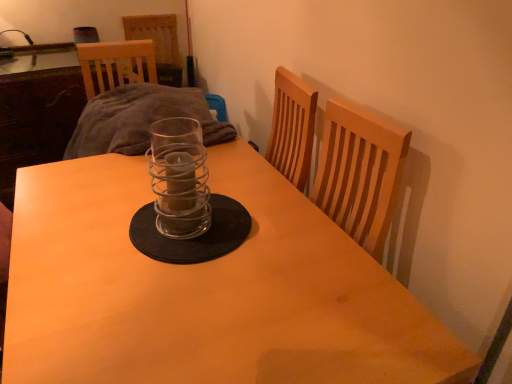
I want to click on wooden table at center, so click(x=205, y=290).

Looking at this image, in order to face wooden table at center, should I rotate leftwards or rightwards?

Rotate left and turn 8.654 degrees.

The image size is (512, 384). What do you see at coordinates (205, 290) in the screenshot?
I see `wooden table at center` at bounding box center [205, 290].

The width and height of the screenshot is (512, 384). Describe the element at coordinates (179, 178) in the screenshot. I see `clear glass candle holder at center` at that location.

The width and height of the screenshot is (512, 384). What are the coordinates of `clear glass candle holder at center` in the screenshot? It's located at (179, 178).

In order to click on wooden table at center in this screenshot , I will do `click(205, 290)`.

Can you confirm if wooden table at center is positioned to the right of clear glass candle holder at center?

In fact, wooden table at center is to the left of clear glass candle holder at center.

Is wooden table at center positioned behind clear glass candle holder at center?

No, wooden table at center is in front of clear glass candle holder at center.

Does point (197, 305) come farther from viewer compared to point (153, 130)?

No.

From the image's perspective, who appears lower, wooden table at center or clear glass candle holder at center?

wooden table at center appears lower in the image.

From a real-world perspective, which object stands above the other?

clear glass candle holder at center is physically above.

Which of these two, wooden table at center or clear glass candle holder at center, is thinner?

With smaller width is clear glass candle holder at center.

In terms of height, does wooden table at center look taller or shorter compared to clear glass candle holder at center?

wooden table at center is taller than clear glass candle holder at center.

From the picture: Can you confirm if wooden table at center is bigger than clear glass candle holder at center?

Indeed, wooden table at center has a larger size compared to clear glass candle holder at center.

Is wooden table at center inside the boundaries of clear glass candle holder at center, or outside?

wooden table at center is spatially situated outside clear glass candle holder at center.

Are wooden table at center and clear glass candle holder at center beside each other?

No, wooden table at center is not making contact with clear glass candle holder at center.

Is wooden table at center facing away from clear glass candle holder at center?

wooden table at center is not turned away from clear glass candle holder at center.

Can you tell me how much wooden table at center and clear glass candle holder at center differ in facing direction?

The facing directions of wooden table at center and clear glass candle holder at center are 0.887 degrees apart.

At what (x,y) coordinates should I click in order to perform the action: click on table in front of the clear glass candle holder at center. Please return your answer as a coordinate pair (x, y). Looking at the image, I should click on click(x=205, y=290).

Considering the positions of objects clear glass candle holder at center and wooden table at center in the image provided, who is more to the left, clear glass candle holder at center or wooden table at center?

wooden table at center.

Is the depth of clear glass candle holder at center greater than that of wooden table at center?

Yes, it is behind wooden table at center.

Considering the points (180, 216) and (169, 348), which point is in front, point (180, 216) or point (169, 348)?

Point (169, 348)

From the image's perspective, is clear glass candle holder at center beneath wooden table at center?

No.

From a real-world perspective, who is located lower, clear glass candle holder at center or wooden table at center?

From a 3D spatial view, wooden table at center is below.

Considering the sizes of objects clear glass candle holder at center and wooden table at center in the image provided, who is thinner, clear glass candle holder at center or wooden table at center?

With smaller width is clear glass candle holder at center.

Is clear glass candle holder at center taller than wooden table at center?

Incorrect, the height of clear glass candle holder at center is not larger of that of wooden table at center.

From the picture: In terms of size, does clear glass candle holder at center appear bigger or smaller than wooden table at center?

In the image, clear glass candle holder at center appears to be smaller than wooden table at center.

Is clear glass candle holder at center not inside wooden table at center?

Absolutely, clear glass candle holder at center is external to wooden table at center.

Are clear glass candle holder at center and wooden table at center located far from each other?

No, clear glass candle holder at center is not far away from wooden table at center.

Is clear glass candle holder at center oriented away from wooden table at center?

clear glass candle holder at center does not have its back to wooden table at center.

What's the angular difference between clear glass candle holder at center and wooden table at center's facing directions?

The facing directions of clear glass candle holder at center and wooden table at center are 0.887 degrees apart.

Find the location of a particular element. Image resolution: width=512 pixels, height=384 pixels. candle holder located behind the wooden table at center is located at coordinates (179, 178).

Where is `table below the clear glass candle holder at center (from a real-world perspective)`? table below the clear glass candle holder at center (from a real-world perspective) is located at coordinates (205, 290).

Locate an element on the screen. The image size is (512, 384). table on the left of the clear glass candle holder at center is located at coordinates (205, 290).